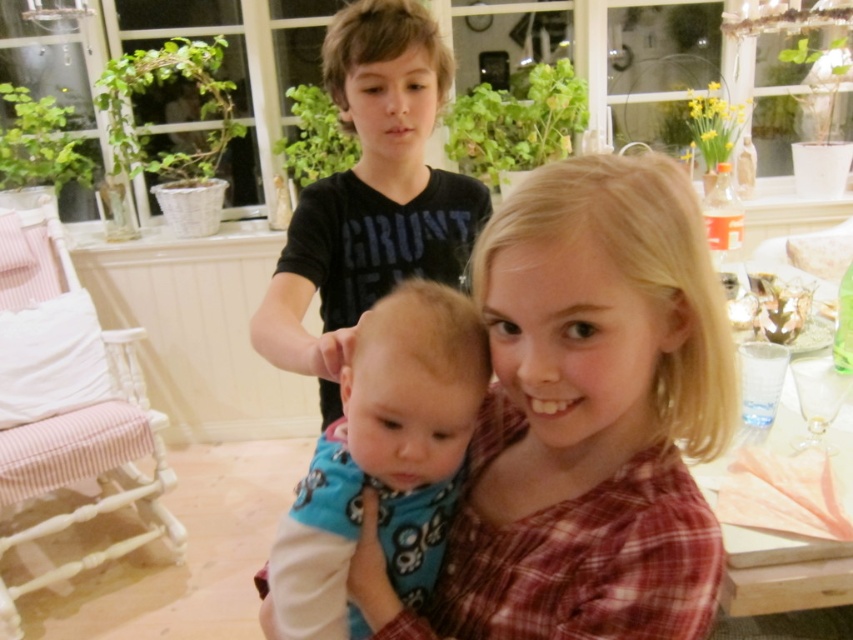
You are a photographer setting up a shoot in the living room. You need to position a light source to ensure both the black matte shirt at upper center and the blue fabric baby at center are well lit. Given their positions, where should you place the light source relative to the photographer?

The blue fabric baby at center is behind the black matte shirt at upper center, so placing the light source in front of the photographer would illuminate both subjects effectively.

What is located at the coordinates point (585, 419)?

The plaid fabric shirt at center is located at point (585, 419).